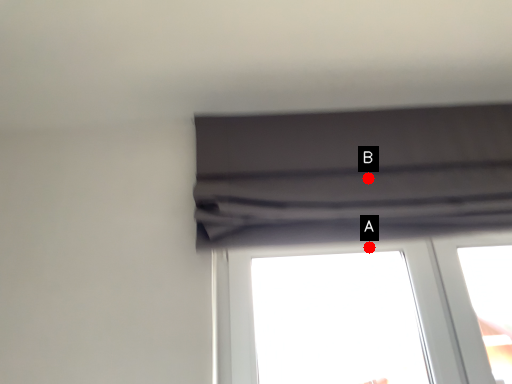
Question: Two points are circled on the image, labeled by A and B beside each circle. Which point is closer to the camera?

Choices:
 (A) A is closer
 (B) B is closer

Answer: (B)